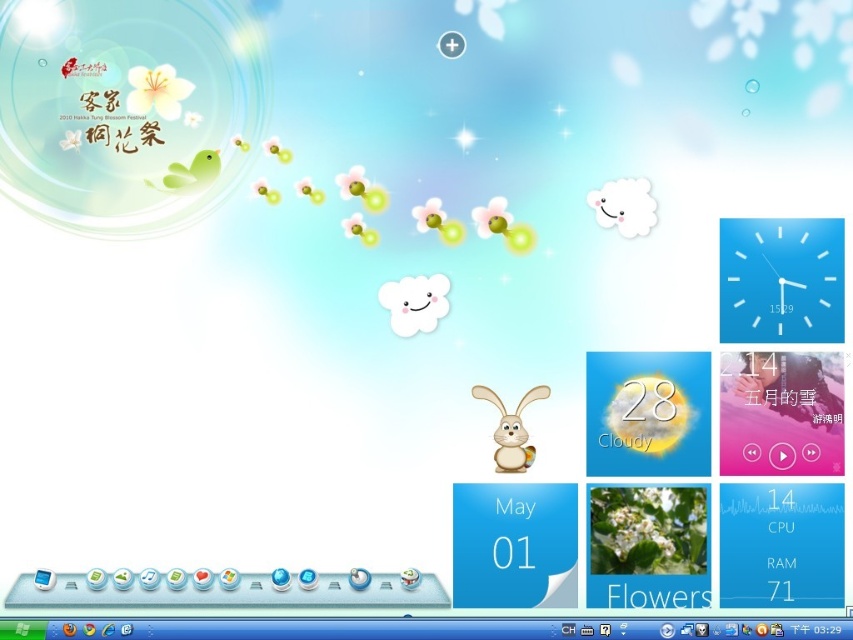
Does white plastic clock at upper right have a smaller size compared to white matte rabbit at center?

Actually, white plastic clock at upper right might be larger than white matte rabbit at center.

Is point (718, 305) more distant than point (526, 448)?

No, (718, 305) is in front of (526, 448).

Where is `white plastic clock at upper right`? white plastic clock at upper right is located at coordinates (781, 280).